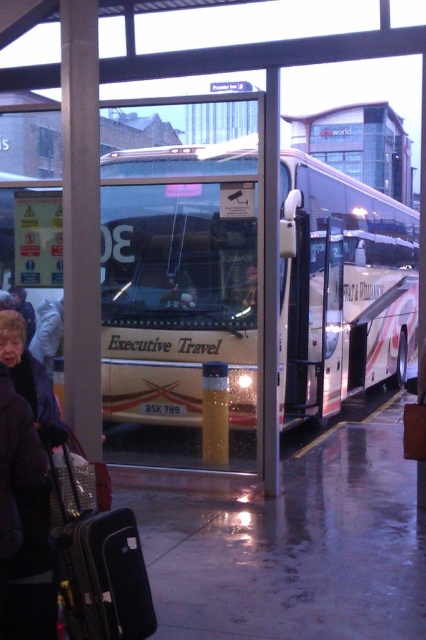
Is white glossy bus at center taller than black hard suitcase at lower left?

No, white glossy bus at center is not taller than black hard suitcase at lower left.

Between white glossy bus at center and black hard suitcase at lower left, which one is positioned lower?

black hard suitcase at lower left is below.

This screenshot has width=426, height=640. What do you see at coordinates (175, 284) in the screenshot? I see `white glossy bus at center` at bounding box center [175, 284].

Locate an element on the screen. The image size is (426, 640). white glossy bus at center is located at coordinates (175, 284).